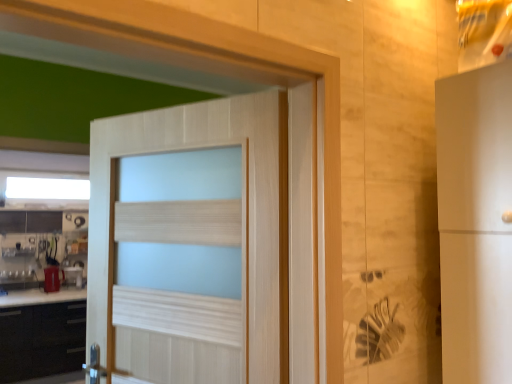
Question: Relative to white frosted glass window at upper center, is black matte cabinet at lower left in front or behind?

Choices:
 (A) behind
 (B) front

Answer: (B)

Question: From the image's perspective, is black matte cabinet at lower left located above or below white frosted glass window at upper center?

Choices:
 (A) below
 (B) above

Answer: (A)

Question: Estimate the real-world distances between objects in this image. Which object is closer to the matte red cup at lower left, which is counted as the first appliance, starting from the back?

Choices:
 (A) black matte cabinet at lower left
 (B) metallic silver kettle at left, which is the second appliance in back-to-front order
 (C) light wood door at center
 (D) white frosted glass window at upper center

Answer: (B)

Question: Which object is positioned farthest from the white frosted glass window at upper center?

Choices:
 (A) matte red cup at lower left, which is counted as the first appliance, starting from the back
 (B) black matte cabinet at lower left
 (C) metallic silver kettle at left, the first appliance from the front
 (D) light wood door at center

Answer: (D)